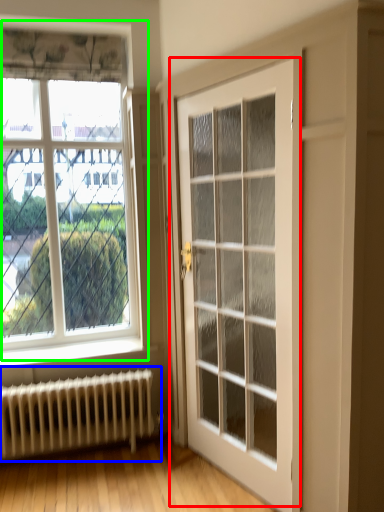
Question: Based on their relative distances, which object is farther from door (highlighted by a red box)? Choose from radiator (highlighted by a blue box) and window (highlighted by a green box).

Choices:
 (A) radiator
 (B) window

Answer: (A)